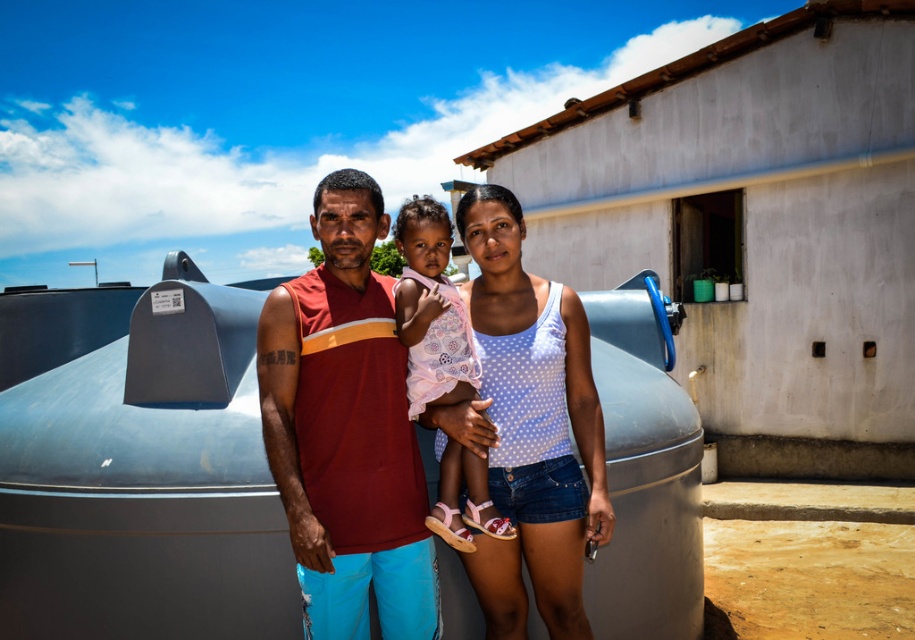
Question: Which object is the farthest from the pink polka dot dress at center?

Choices:
 (A) white dotted tank top at center
 (B) brushed metal water tank at center

Answer: (B)

Question: Does maroon sleeveless shirt at center have a lesser width compared to white dotted tank top at center?

Choices:
 (A) yes
 (B) no

Answer: (A)

Question: Which point is farther to the camera?

Choices:
 (A) (444, 552)
 (B) (325, 541)

Answer: (A)

Question: Which of the following is the farthest from the observer?

Choices:
 (A) click(x=329, y=556)
 (B) click(x=445, y=540)

Answer: (B)

Question: Does brushed metal water tank at center lie behind maroon sleeveless shirt at center?

Choices:
 (A) yes
 (B) no

Answer: (A)

Question: Does brushed metal water tank at center have a smaller size compared to white dotted tank top at center?

Choices:
 (A) yes
 (B) no

Answer: (B)